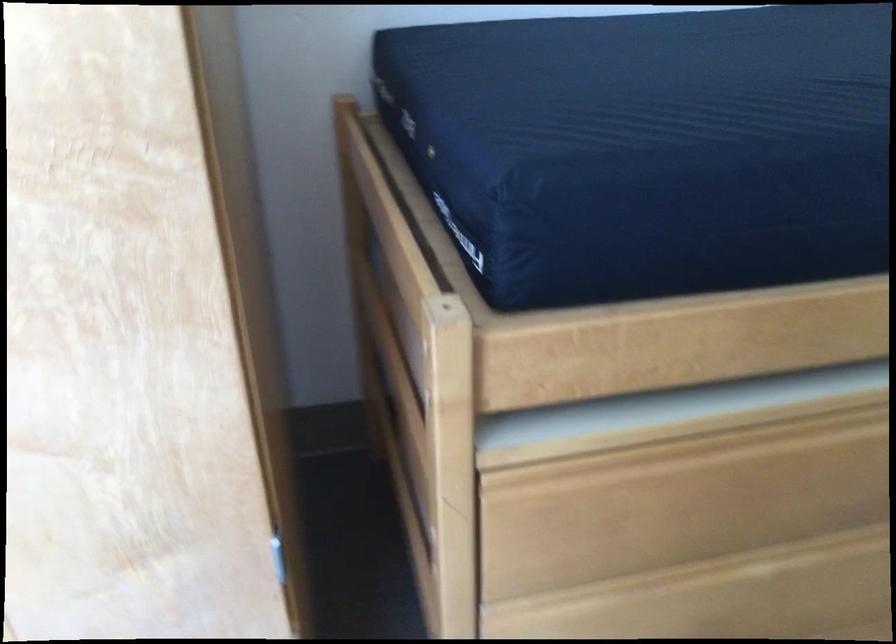
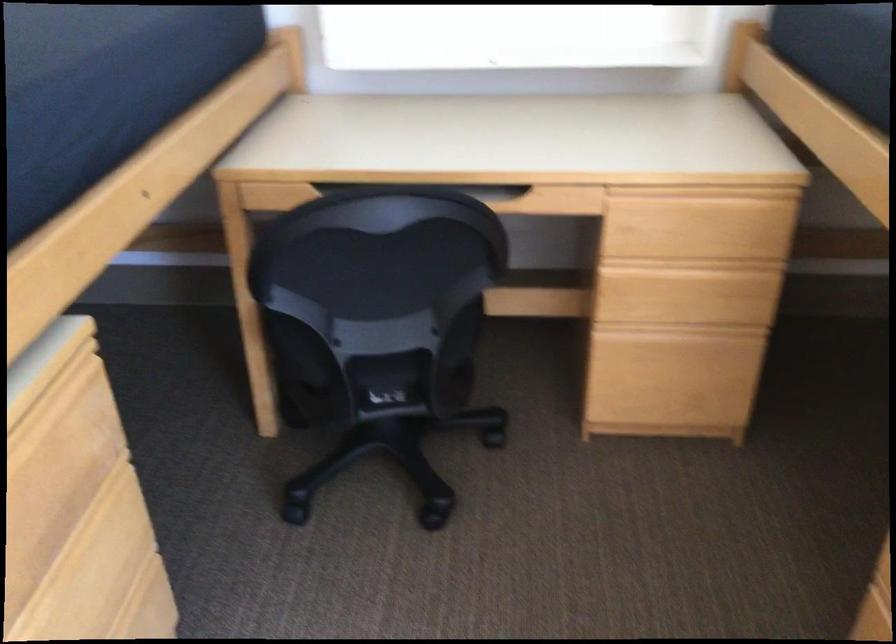
Based on the continuous images, in which direction is the camera rotating?

The camera's rotation is toward right-down.